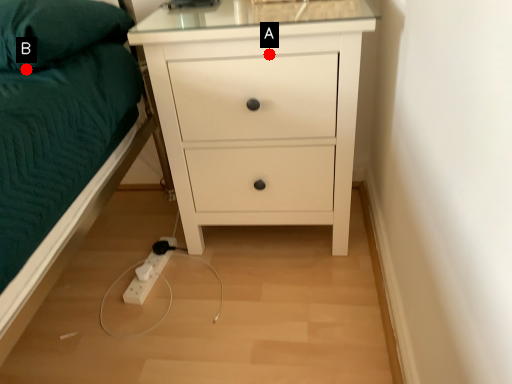
Question: Two points are circled on the image, labeled by A and B beside each circle. Which point appears farthest from the camera in this image?

Choices:
 (A) A is further
 (B) B is further

Answer: (A)